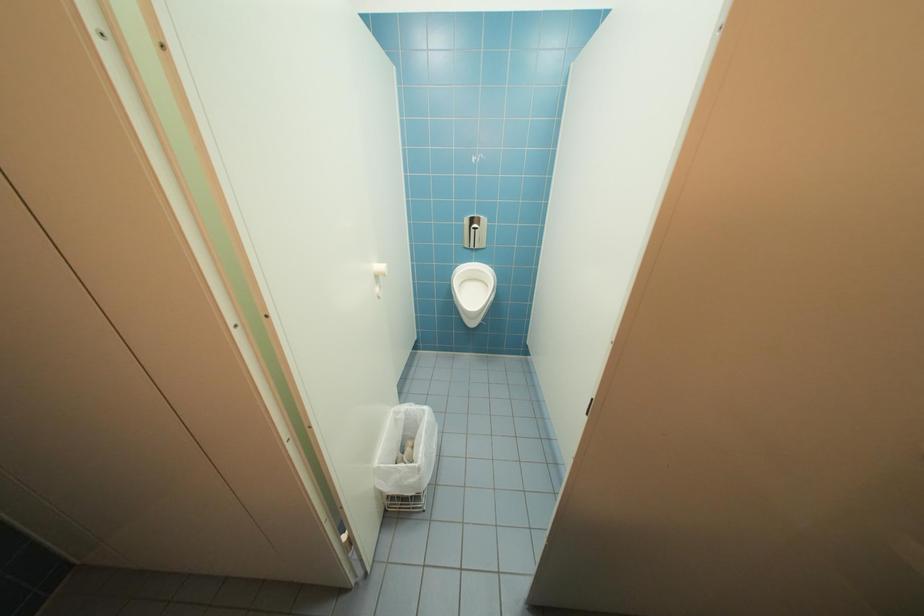
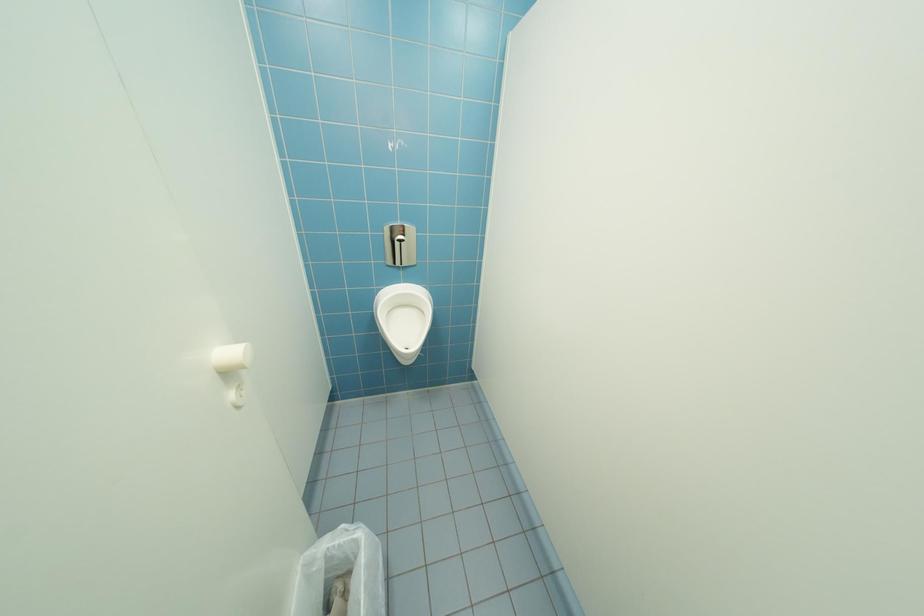
Question: The camera is either moving clockwise (left) or counter-clockwise (right) around the object. The first image is from the beginning of the video and the second image is from the end. Is the camera moving left or right when shooting the video?

Choices:
 (A) Left
 (B) Right

Answer: (A)